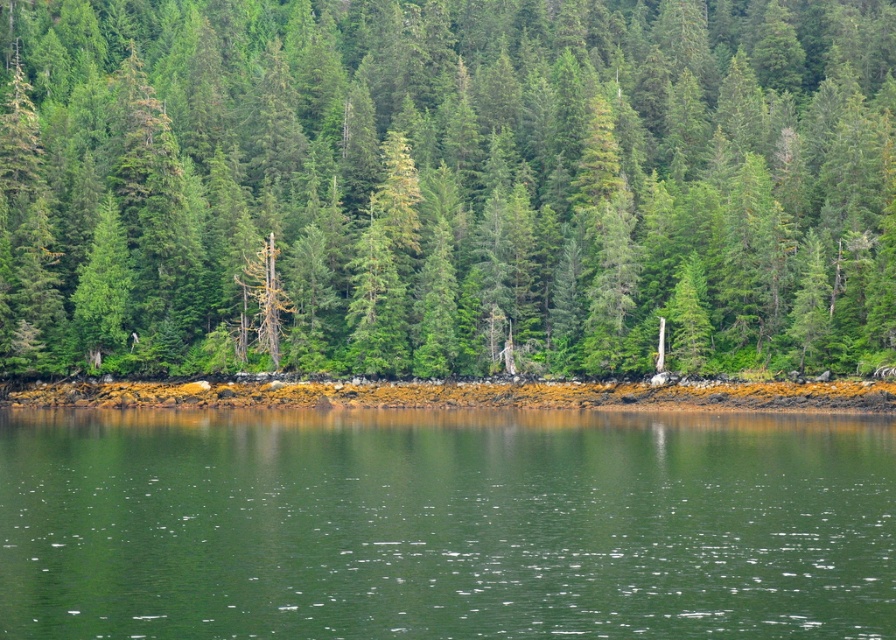
You are a hiker standing at the forest edge and want to reach the water. Based on the image, what are the coordinates of the green smooth water at center that you should head towards?

The coordinates of the green smooth water at center are at point (444,524).

You are a hiker who wants to cross from the green matte tree at center to the green smooth water at center. Can you walk directly between them without needing to go around?

The distance between the green matte tree at center and the green smooth water at center is 47.02 meters, so yes, you can walk directly between them without needing to go around.